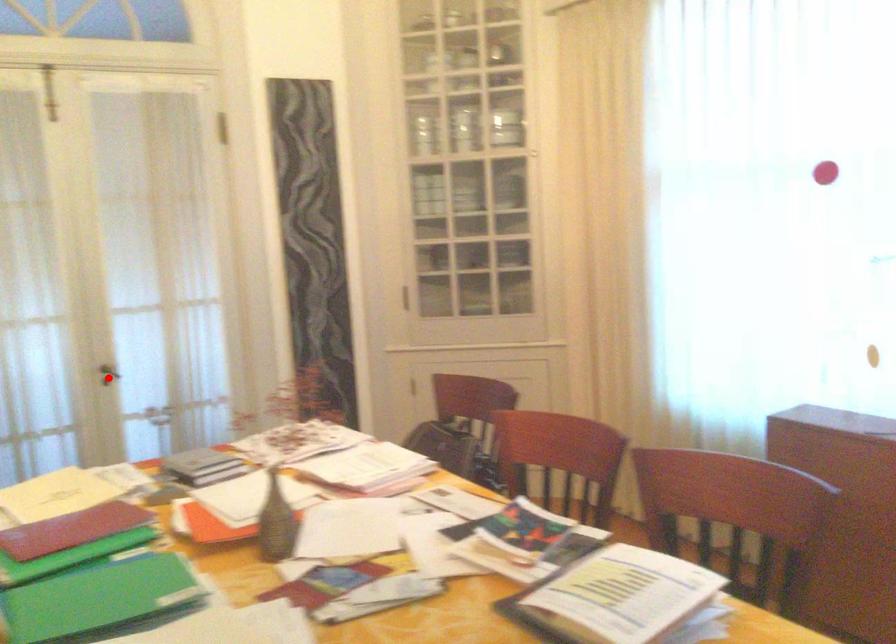
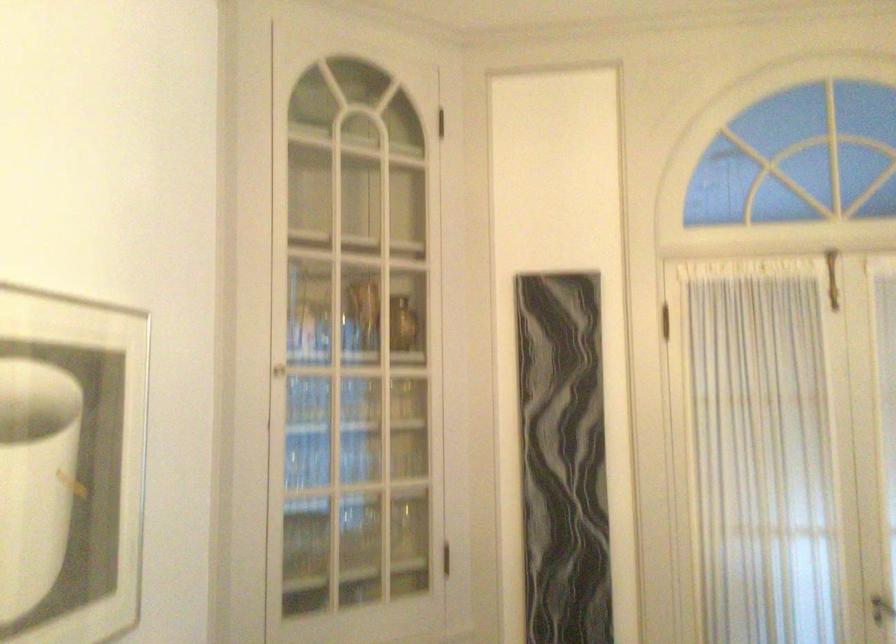
Question: I am providing you with two images of the same scene from different viewpoints. A red point is shown in image1. For the corresponding object point in image2, is it positioned nearer or farther from the camera?

Choices:
 (A) Nearer
 (B) Farther

Answer: (A)